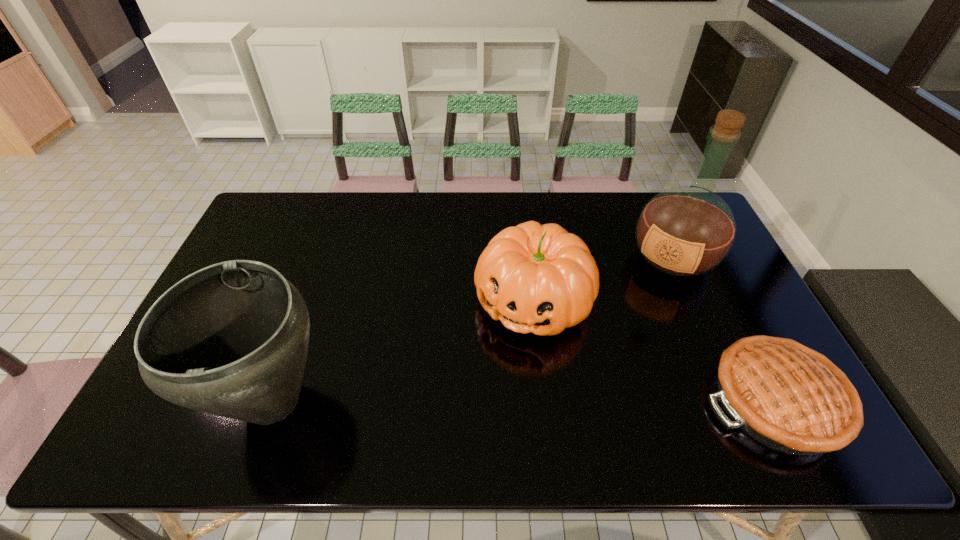
What are the coordinates of `free space between the tallest object and the second object from left to right` in the screenshot? It's located at (603, 279).

The image size is (960, 540). Identify the location of blank region between the tallest object and the leftmost object. (473, 329).

What are the coordinates of `free area in between the second shortest object and the tallest object` in the screenshot? It's located at (603, 279).

The image size is (960, 540). What are the coordinates of `free spot between the leftmost object and the pumpkin` in the screenshot? It's located at (403, 350).

Image resolution: width=960 pixels, height=540 pixels. Identify the location of free spot between the pie and the second tallest object. (524, 401).

What are the coordinates of `free spot between the second tallest object and the second object from left to right` in the screenshot? It's located at (403, 350).

You are a GUI agent. You are given a task and a screenshot of the screen. Output one action in this format:
    pyautogui.click(x=<x>, y=<y>)
    Task: Click on the blank region between the urn and the pie
    The width and height of the screenshot is (960, 540).
    Given the screenshot: What is the action you would take?
    (524, 401)

Select which object is the closest to the shortest object. Please provide its 2D coordinates. Your answer should be formatted as a tuple, i.e. [(x, y)], where the tuple contains the x and y coordinates of a point satisfying the conditions above.

[(535, 278)]

This screenshot has width=960, height=540. Find the location of `object that is the second nearest to the second object from left to right`. object that is the second nearest to the second object from left to right is located at coordinates (791, 398).

Find the location of a particular element. vacant space that satisfies the following two spatial constraints: 1. on the back side of the tallest object; 2. on the right side of the second object from left to right is located at coordinates (528, 258).